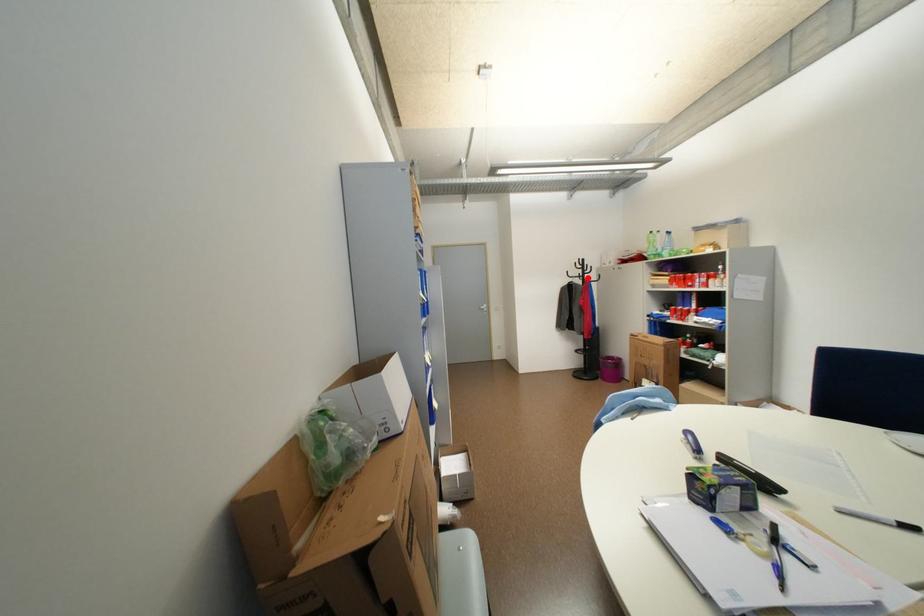
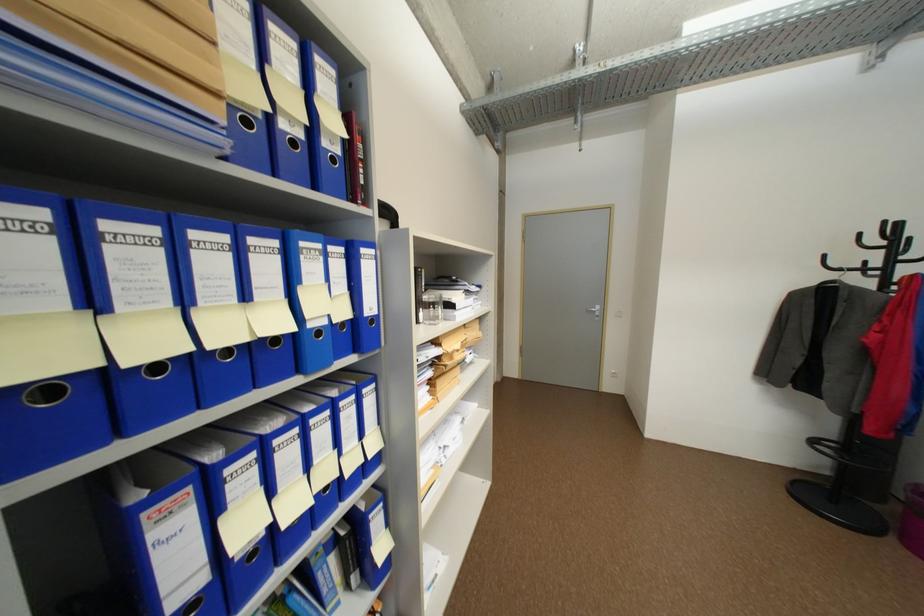
Question: I am providing you with two images of the same scene from different viewpoints. Image1 has a red point marked. In image2, the corresponding 3D location appears at what relative position? Reply with the corresponding letter.

Choices:
 (A) Closer
 (B) Farther

Answer: (B)